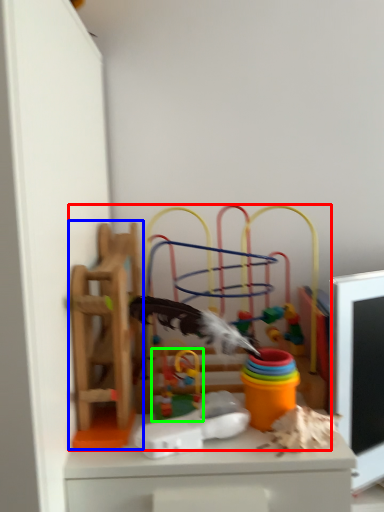
Question: Which object is positioned farthest from toy (highlighted by a red box)? Select from toy (highlighted by a blue box) and toy (highlighted by a green box).

Choices:
 (A) toy
 (B) toy

Answer: (B)